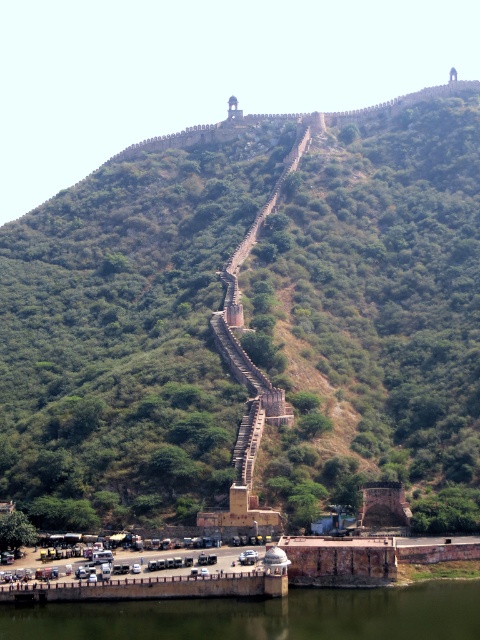
You are a tour guide leading a group to the top of the hill. You notice the green stone staircase at upper center and the green concrete river at lower center. Which path should you take to reach the top efficiently?

The green stone staircase at upper center is bigger than the green concrete river at lower center, so you should take the green stone staircase at upper center to reach the top efficiently since it is more suitable for climbing.